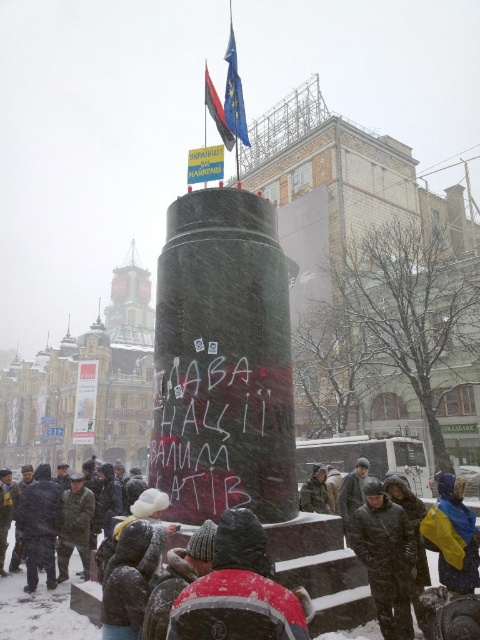
Looking at this image, between black marble pillar at center and camouflage uniform at center, which one appears on the right side from the viewer's perspective?

black marble pillar at center is more to the right.

Measure the distance between black marble pillar at center and camouflage uniform at center.

black marble pillar at center and camouflage uniform at center are 11.27 meters apart from each other.

Between point (276, 428) and point (81, 502), which one is positioned in front?

Point (276, 428) is in front.

The width and height of the screenshot is (480, 640). Find the location of `black marble pillar at center`. black marble pillar at center is located at coordinates (223, 360).

Is black marble pillar at center bigger than camouflage fabric jacket at center?

Correct, black marble pillar at center is larger in size than camouflage fabric jacket at center.

Consider the image. Who is positioned more to the left, black marble pillar at center or camouflage fabric jacket at center?

black marble pillar at center is more to the left.

Identify the location of black marble pillar at center. click(x=223, y=360).

You are a GUI agent. You are given a task and a screenshot of the screen. Output one action in this format:
    pyautogui.click(x=<x>, y=<y>)
    Task: Click on the black marble pillar at center
    
    Given the screenshot: What is the action you would take?
    [x=223, y=360]

Is point (300, 556) closer to camera compared to point (303, 502)?

Yes.

Is dark gray marble statue at center wider than camouflage fabric jacket at center?

Yes, dark gray marble statue at center is wider than camouflage fabric jacket at center.

You are a GUI agent. You are given a task and a screenshot of the screen. Output one action in this format:
    pyautogui.click(x=<x>, y=<y>)
    Task: Click on the dark gray marble statue at center
    
    Given the screenshot: What is the action you would take?
    pyautogui.click(x=322, y=570)